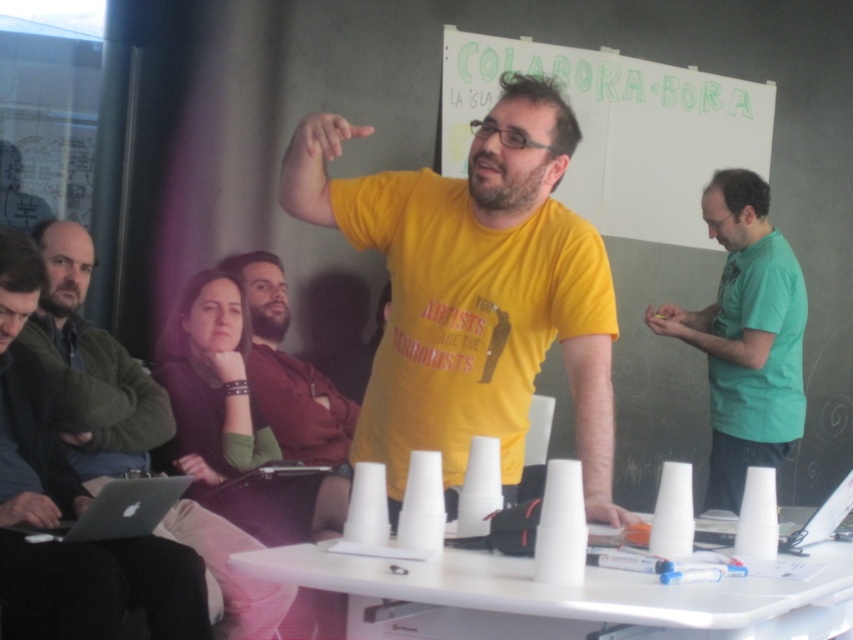
You are standing at the back of the room and want to see the whiteboard. There is a green matte shirt at right and a bearded man at center in front of you. Which person might be blocking your view more?

The green matte shirt at right is taller than the bearded man at center, so it might block your view more.